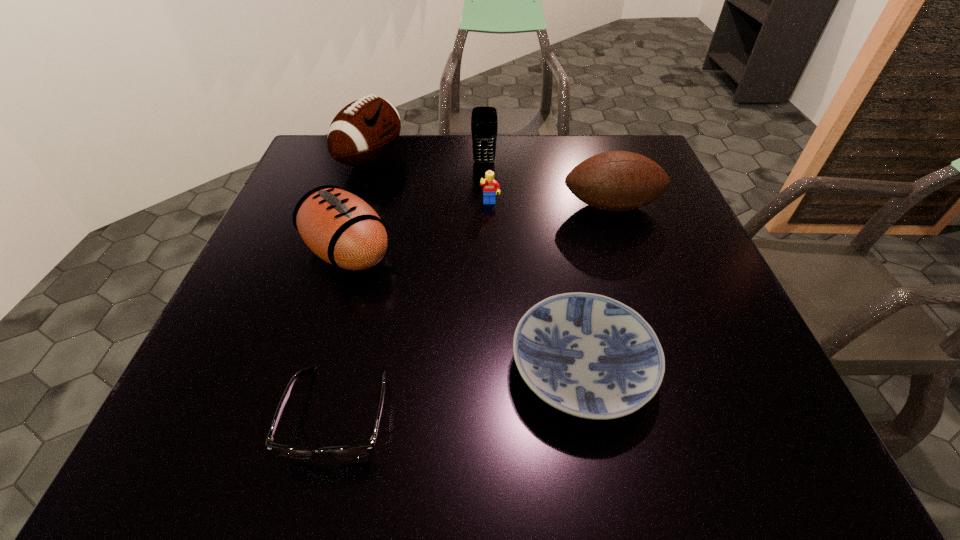
The image size is (960, 540). Find the location of `the farthest football (American)`. the farthest football (American) is located at coordinates pyautogui.click(x=364, y=131).

Find the location of `cellular telephone`. cellular telephone is located at coordinates (484, 123).

You are a GUI agent. You are given a task and a screenshot of the screen. Output one action in this format:
    pyautogui.click(x=<x>, y=<y>)
    Task: Click on the rightmost football (American)
    
    Given the screenshot: What is the action you would take?
    pyautogui.click(x=617, y=181)

Image resolution: width=960 pixels, height=540 pixels. I want to click on Lego, so click(x=490, y=187).

The image size is (960, 540). Find the location of `plate`. plate is located at coordinates (588, 355).

Locate an element on the screen. This screenshot has height=540, width=960. spectacles is located at coordinates (354, 451).

Identify the location of vacant space located on the right of the tallest football (American). 470,159.

Locate an element on the screen. The width and height of the screenshot is (960, 540). vacant area located on the screen of the cellular telephone is located at coordinates (485, 190).

Find the location of `free space located 0.200m on the laces of the rightmost football (American)`. free space located 0.200m on the laces of the rightmost football (American) is located at coordinates (638, 287).

Find the location of a particular element. blank space located 0.280m on the face of the Lego is located at coordinates (492, 292).